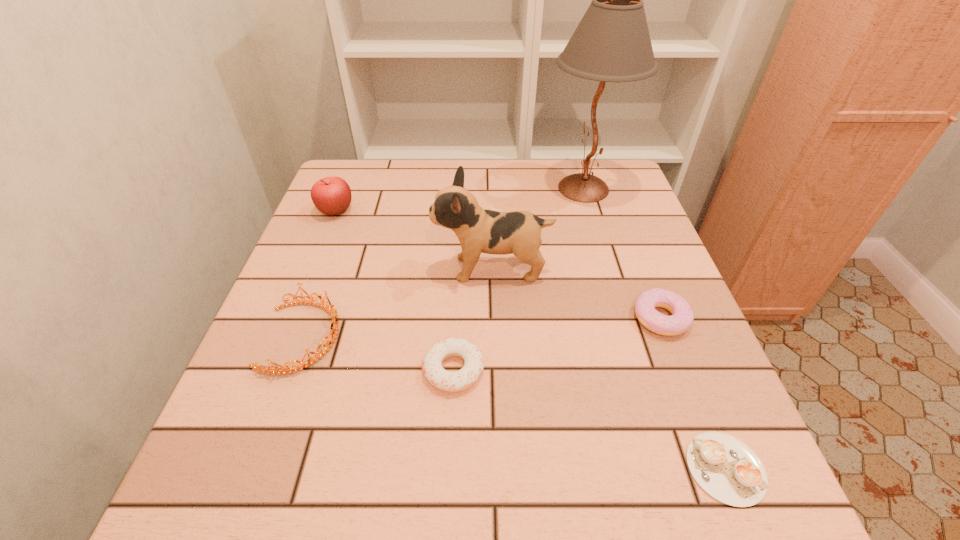
Where is `object situated at the near right corner`? Image resolution: width=960 pixels, height=540 pixels. object situated at the near right corner is located at coordinates (727, 469).

Find the location of a particular element. The width and height of the screenshot is (960, 540). vacant space at the far edge of the desktop is located at coordinates (425, 173).

The image size is (960, 540). I want to click on vacant space at the near edge of the desktop, so click(584, 502).

Where is `blank area at the left edge`? blank area at the left edge is located at coordinates (343, 250).

Locate an element on the screen. This screenshot has height=540, width=960. vacant space at the right edge is located at coordinates (661, 375).

At what (x,y) coordinates should I click in order to perform the action: click on free space at the far left corner. Please return your answer as a coordinate pair (x, y). The image size is (960, 540). Looking at the image, I should click on (362, 174).

Find the location of a particular element. free space at the far right corner is located at coordinates (597, 172).

This screenshot has height=540, width=960. I want to click on unoccupied position between the apple and the tiara, so click(x=320, y=274).

Locate an element on the screen. The height and width of the screenshot is (540, 960). vacant point located between the left doughnut and the apple is located at coordinates (395, 291).

Where is `free spot between the third farthest object and the apple`? Image resolution: width=960 pixels, height=540 pixels. free spot between the third farthest object and the apple is located at coordinates (414, 240).